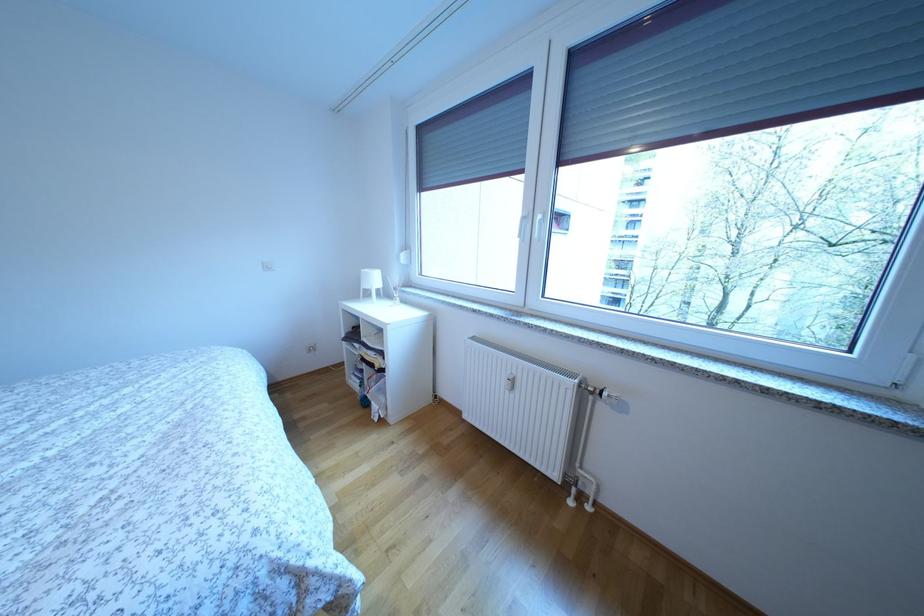
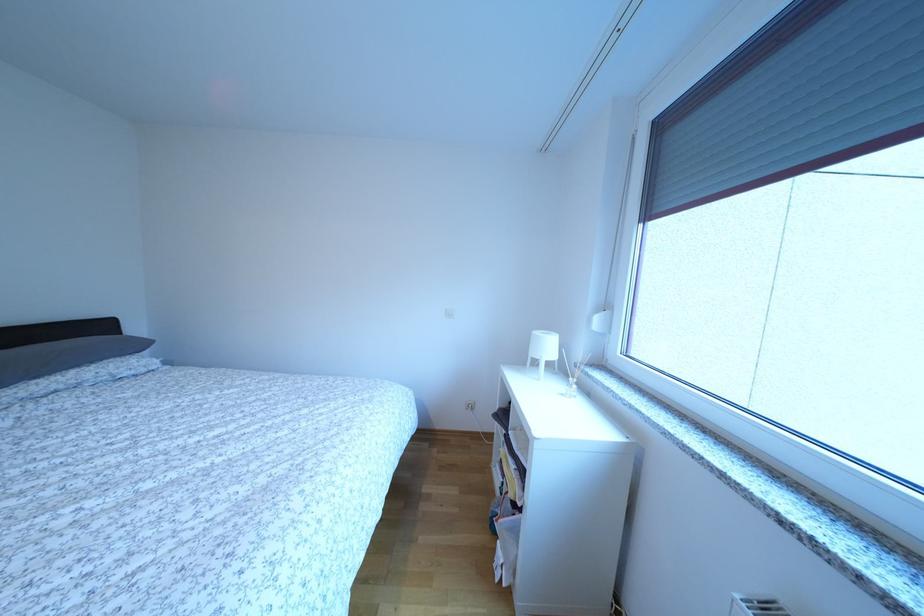
Question: The camera is either moving clockwise (left) or counter-clockwise (right) around the object. The first image is from the beginning of the video and the second image is from the end. Is the camera moving left or right when shooting the video?

Choices:
 (A) Left
 (B) Right

Answer: (B)